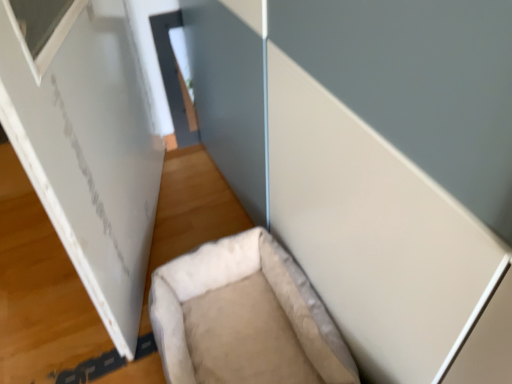
Question: Considering the relative positions of beige fabric pet bed at lower center and white matte board at left in the image provided, is beige fabric pet bed at lower center to the right of white matte board at left from the viewer's perspective?

Choices:
 (A) yes
 (B) no

Answer: (A)

Question: From a real-world perspective, is beige fabric pet bed at lower center positioned over white matte board at left based on gravity?

Choices:
 (A) yes
 (B) no

Answer: (B)

Question: Is beige fabric pet bed at lower center positioned before white matte board at left?

Choices:
 (A) yes
 (B) no

Answer: (B)

Question: Is beige fabric pet bed at lower center further to camera compared to white matte board at left?

Choices:
 (A) no
 (B) yes

Answer: (B)

Question: From a real-world perspective, is beige fabric pet bed at lower center physically below white matte board at left?

Choices:
 (A) yes
 (B) no

Answer: (A)

Question: Is beige fabric pet bed at lower center in contact with white matte board at left?

Choices:
 (A) no
 (B) yes

Answer: (A)

Question: Considering the relative sizes of white matte board at left and beige fabric pet bed at lower center in the image provided, is white matte board at left taller than beige fabric pet bed at lower center?

Choices:
 (A) no
 (B) yes

Answer: (B)

Question: Is white matte board at left bigger than beige fabric pet bed at lower center?

Choices:
 (A) yes
 (B) no

Answer: (A)

Question: From the image's perspective, would you say white matte board at left is shown under beige fabric pet bed at lower center?

Choices:
 (A) yes
 (B) no

Answer: (B)

Question: Can we say white matte board at left lies outside beige fabric pet bed at lower center?

Choices:
 (A) no
 (B) yes

Answer: (B)

Question: Is white matte board at left wider than beige fabric pet bed at lower center?

Choices:
 (A) no
 (B) yes

Answer: (A)

Question: Is white matte board at left far away from beige fabric pet bed at lower center?

Choices:
 (A) yes
 (B) no

Answer: (B)

Question: Is beige fabric pet bed at lower center to the left or to the right of white matte board at left in the image?

Choices:
 (A) right
 (B) left

Answer: (A)